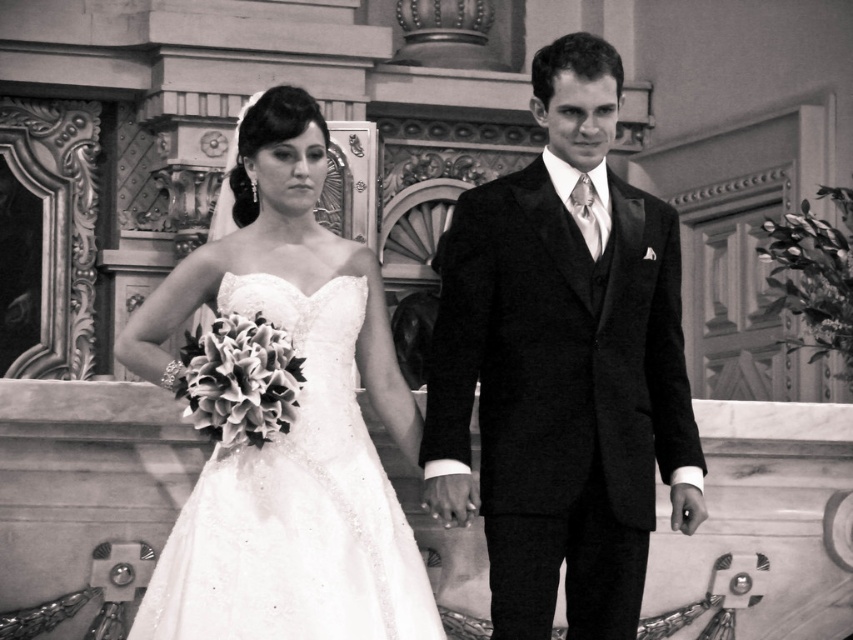
Question: Can you confirm if smooth black suit at center is positioned to the right of satin dress at center?

Choices:
 (A) no
 (B) yes

Answer: (B)

Question: Is smooth black suit at center bigger than satin dress at center?

Choices:
 (A) no
 (B) yes

Answer: (B)

Question: Which point is farther from the camera taking this photo?

Choices:
 (A) (296, 307)
 (B) (612, 454)

Answer: (A)

Question: Is smooth black suit at center bigger than satin dress at center?

Choices:
 (A) yes
 (B) no

Answer: (A)